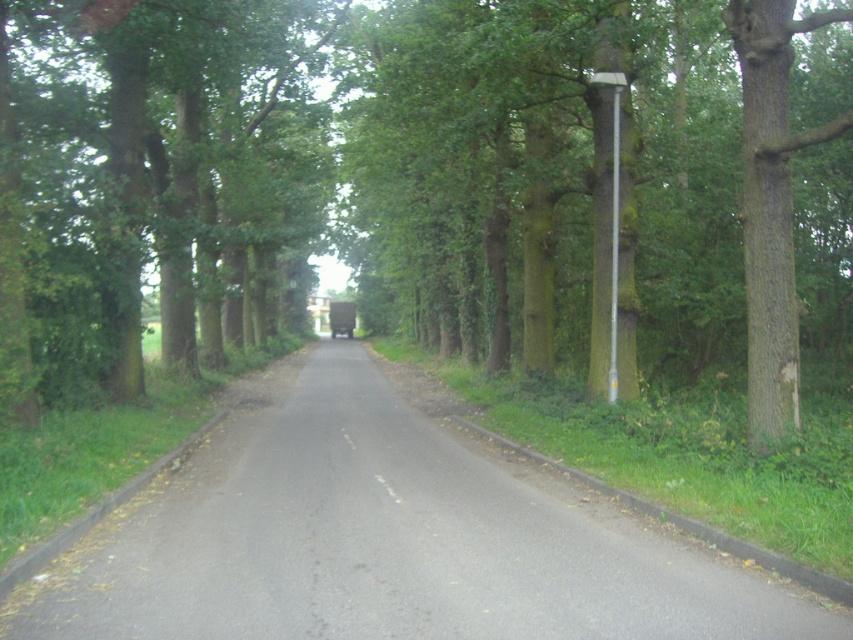
Between green leafy tree at center and asphalt road at center, which one appears on the right side from the viewer's perspective?

Positioned to the right is green leafy tree at center.

Is green leafy tree at center to the right of asphalt road at center from the viewer's perspective?

Correct, you'll find green leafy tree at center to the right of asphalt road at center.

Does point (711, 291) lie behind point (169, 589)?

Yes, point (711, 291) is farther from viewer.

This screenshot has height=640, width=853. I want to click on green leafy tree at center, so click(x=303, y=163).

Between green leafy tree at center and metallic pole at right, which one is positioned lower?

metallic pole at right is lower down.

Can you confirm if green leafy tree at center is taller than metallic pole at right?

Yes, green leafy tree at center is taller than metallic pole at right.

Image resolution: width=853 pixels, height=640 pixels. In order to click on green leafy tree at center in this screenshot , I will do `click(303, 163)`.

You are a GUI agent. You are given a task and a screenshot of the screen. Output one action in this format:
    pyautogui.click(x=<x>, y=<y>)
    Task: Click on the green leafy tree at center
    The width and height of the screenshot is (853, 640).
    Given the screenshot: What is the action you would take?
    pyautogui.click(x=303, y=163)

Between asphalt road at center and metallic pole at right, which one has less height?

Standing shorter between the two is asphalt road at center.

Consider the image. Does asphalt road at center have a smaller size compared to metallic pole at right?

No.

In order to click on asphalt road at center in this screenshot , I will do `click(387, 540)`.